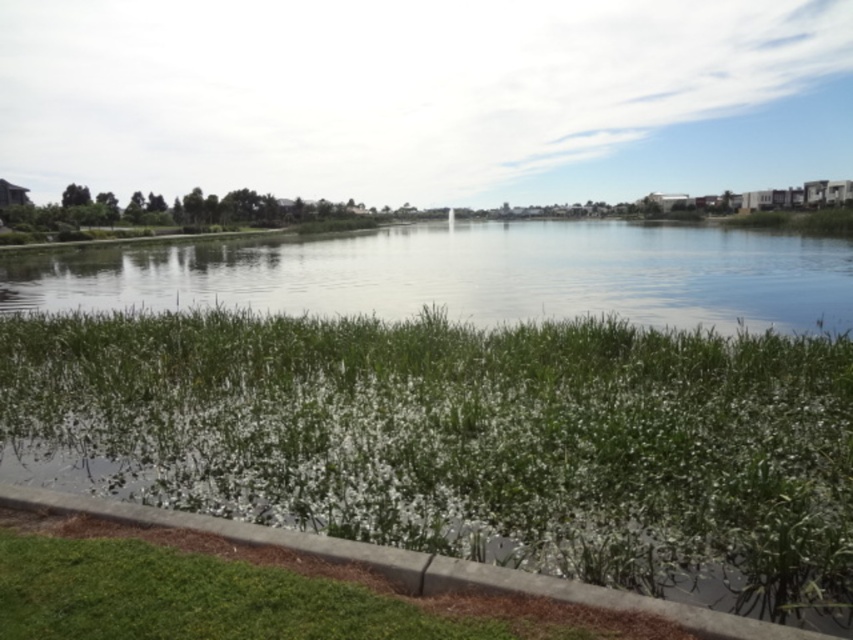
Can you confirm if green grassy river at center is positioned to the right of concrete at lower left?

Indeed, green grassy river at center is positioned on the right side of concrete at lower left.

From the picture: Is green grassy river at center positioned before concrete at lower left?

That is False.

Identify the location of green grassy river at center. (468, 275).

Between green leafy grass at lower center and green grassy river at center, which one is positioned lower?

green leafy grass at lower center

Is green leafy grass at lower center smaller than green grassy river at center?

Indeed, green leafy grass at lower center has a smaller size compared to green grassy river at center.

The height and width of the screenshot is (640, 853). Find the location of `green leafy grass at lower center`. green leafy grass at lower center is located at coordinates 469,440.

Is green leafy grass at lower center shorter than concrete at lower left?

In fact, green leafy grass at lower center may be taller than concrete at lower left.

The image size is (853, 640). Describe the element at coordinates (469, 440) in the screenshot. I see `green leafy grass at lower center` at that location.

Identify the location of green leafy grass at lower center. This screenshot has height=640, width=853. (469, 440).